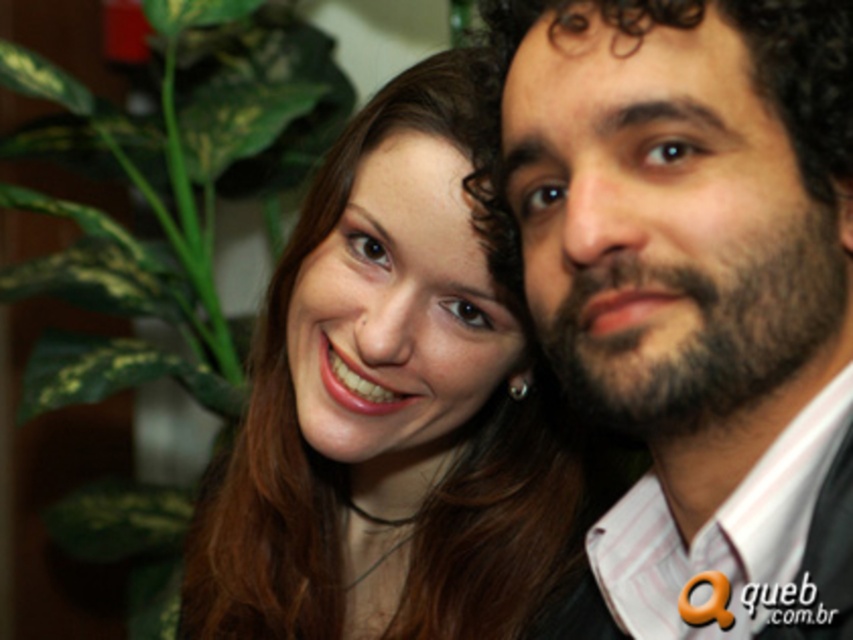
You are taking a photo of two people. You notice the dark brown curly hair at right and the matte skin at center. Which one is closer to the camera?

The dark brown curly hair at right is closer to the camera because it is in front of the matte skin at center.

You are taking a photo of two people standing close together. The person on the right has curly dark hair and a beard. There is a point marked at coordinates (694, 296). Based on the scene description, can you determine what this point is marking?

The point at coordinates (694, 296) marks the dark brown curly hair at right.